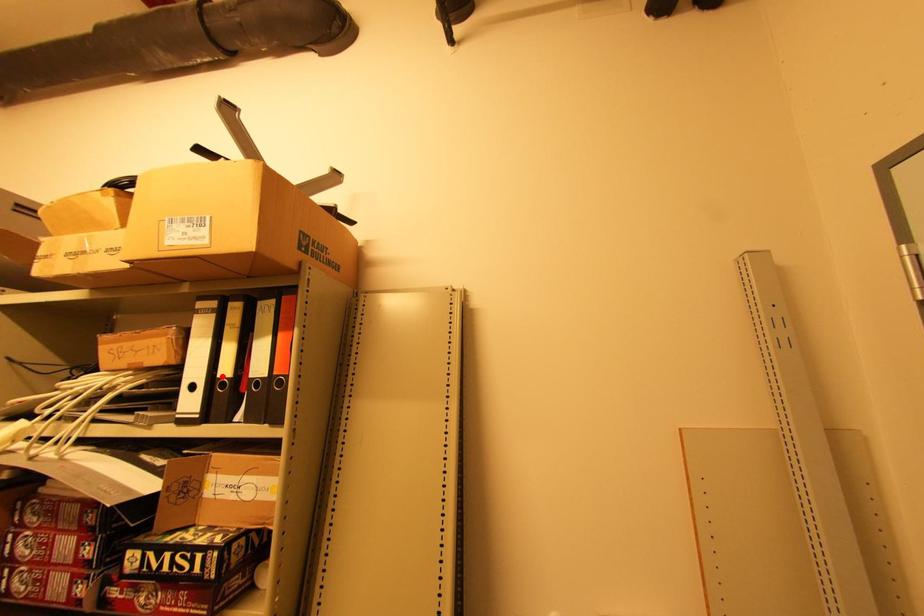
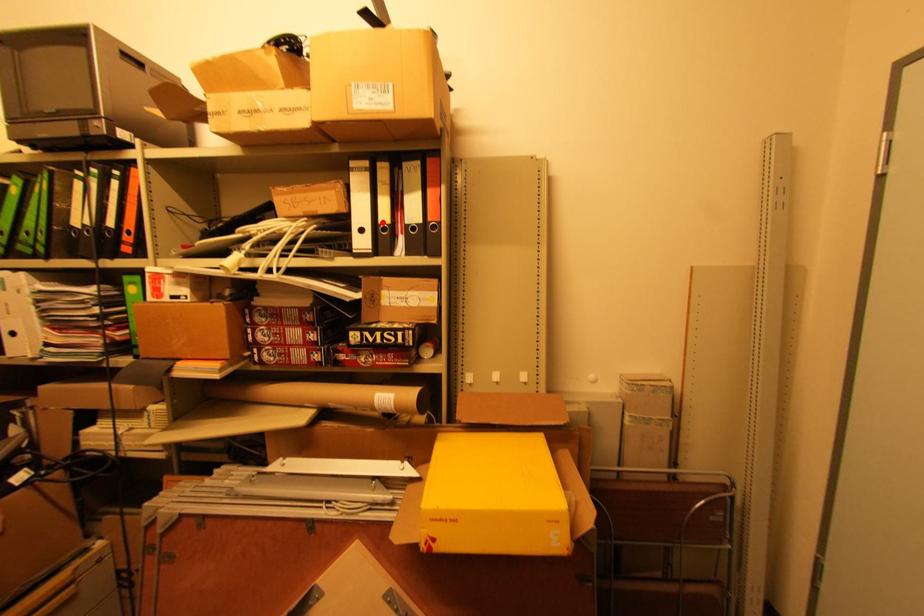
I am providing you with two images of the same scene from different viewpoints. A red point is marked on the first image and another point is marked on the second image. Are the points marked in image1 and image2 representing the same 3D position?

Yes